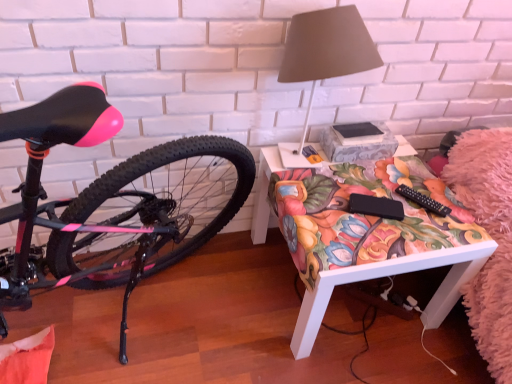
Identify the location of free space to the right of matte gray lampshade at upper right. This screenshot has height=384, width=512. (391, 181).